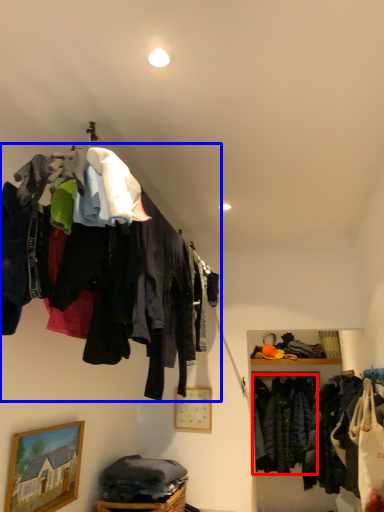
Question: Which object is closer to the camera taking this photo, clothing (highlighted by a red box) or closet (highlighted by a blue box)?

Choices:
 (A) clothing
 (B) closet

Answer: (B)